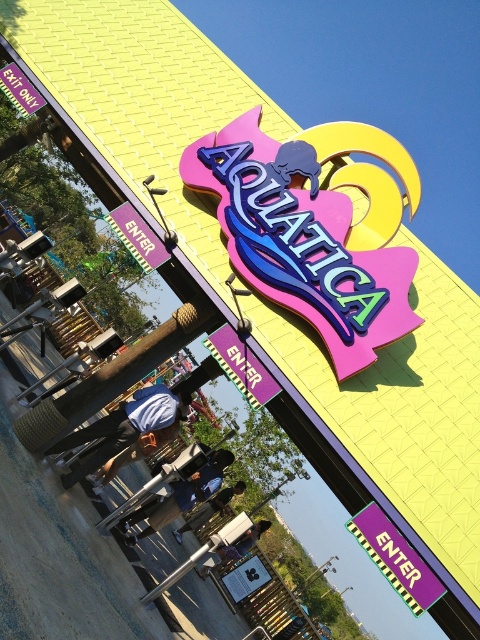
Is glossy plastic aquatica sign at center to the left of purple glossy sign at center from the viewer's perspective?

→ Correct, you'll find glossy plastic aquatica sign at center to the left of purple glossy sign at center.

Is glossy plastic aquatica sign at center wider than purple glossy sign at center?

Indeed, glossy plastic aquatica sign at center has a greater width compared to purple glossy sign at center.

You are a GUI agent. You are given a task and a screenshot of the screen. Output one action in this format:
    pyautogui.click(x=<x>, y=<y>)
    Task: Click on the glossy plastic aquatica sign at center
    The height and width of the screenshot is (640, 480).
    Given the screenshot: What is the action you would take?
    (x=301, y=241)

At what (x,y) coordinates should I click in order to perform the action: click on glossy plastic aquatica sign at center. Please return your answer as a coordinate pair (x, y). This screenshot has height=640, width=480. Looking at the image, I should click on [301, 241].